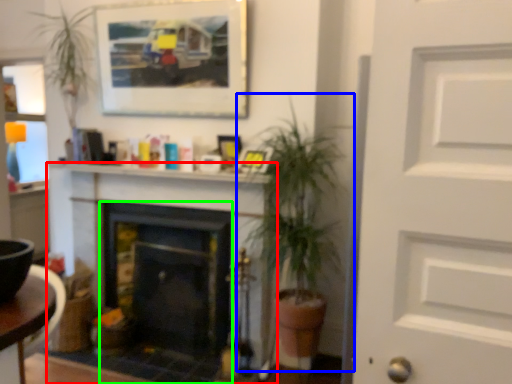
Question: Which is farther away from fireplace (highlighted by a red box)? houseplant (highlighted by a blue box) or fireplace (highlighted by a green box)?

Choices:
 (A) houseplant
 (B) fireplace

Answer: (A)